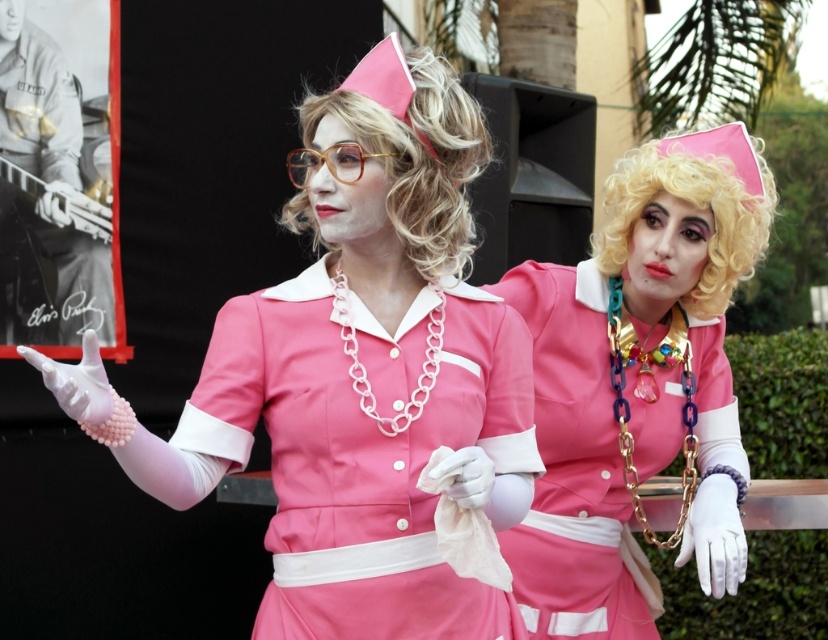
Find the location of a particular element. matte pink fabric dress at center is located at coordinates (360, 460).

Between matte pink fabric dress at center and translucent amber plastic glasses at center, which one has less height?

translucent amber plastic glasses at center is shorter.

Describe the element at coordinates (360, 460) in the screenshot. This screenshot has width=828, height=640. I see `matte pink fabric dress at center` at that location.

Where is `matte pink fabric dress at center`? Image resolution: width=828 pixels, height=640 pixels. matte pink fabric dress at center is located at coordinates (360, 460).

Between matte pink uniform at center and blonde curly wig at upper center, which one has more height?

matte pink uniform at center is taller.

Locate an element on the screen. This screenshot has width=828, height=640. matte pink uniform at center is located at coordinates (631, 371).

At what (x,y) coordinates should I click in order to perform the action: click on matte pink uniform at center. Please return your answer as a coordinate pair (x, y). The height and width of the screenshot is (640, 828). Looking at the image, I should click on click(x=631, y=371).

Does metallic silver guitar at upper left appear over blonde hair at center?

Correct, metallic silver guitar at upper left is located above blonde hair at center.

Can you confirm if metallic silver guitar at upper left is shorter than blonde hair at center?

Incorrect, metallic silver guitar at upper left's height does not fall short of blonde hair at center's.

The image size is (828, 640). I want to click on metallic silver guitar at upper left, so click(x=56, y=172).

Where is `metallic silver guitar at upper left`? metallic silver guitar at upper left is located at coordinates (56, 172).